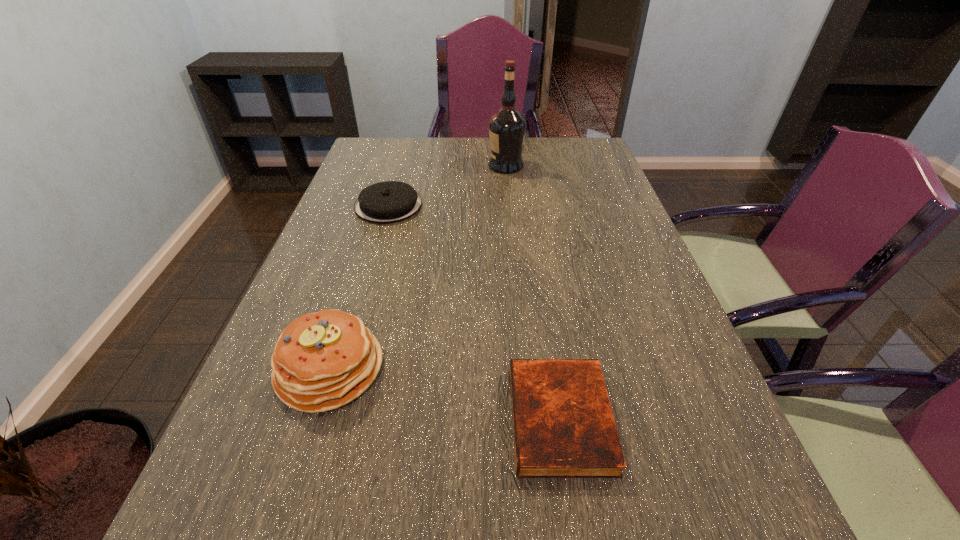
The image size is (960, 540). In order to click on free spot between the farthest object and the shortest object in this screenshot , I will do `click(533, 292)`.

Identify the location of object that is the second closest to the liquor. This screenshot has height=540, width=960. (324, 360).

Select which object is the third closest to the shortest object. Please provide its 2D coordinates. Your answer should be formatted as a tuple, i.e. [(x, y)], where the tuple contains the x and y coordinates of a point satisfying the conditions above.

[(507, 127)]